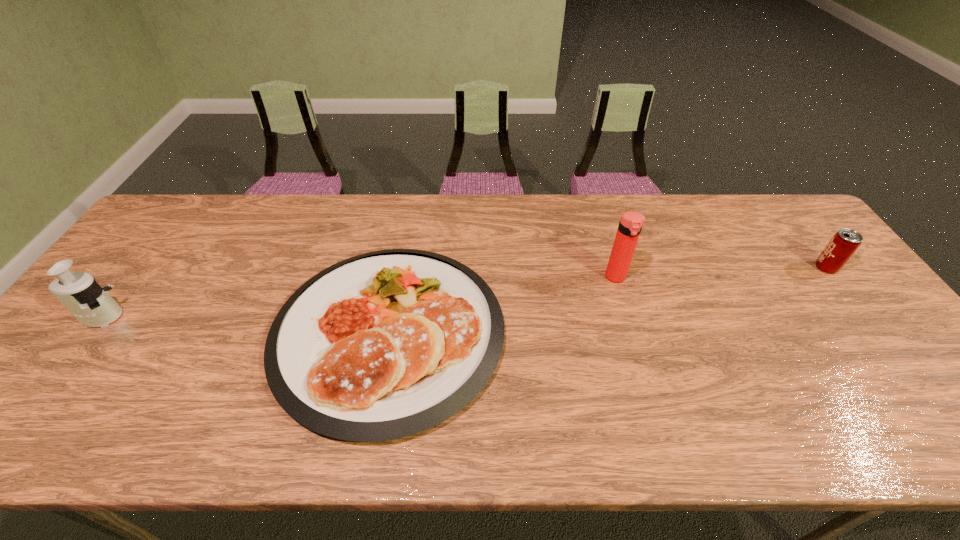
The image size is (960, 540). In order to click on free space located on the back of the rightmost object in this screenshot , I will do `click(781, 211)`.

Image resolution: width=960 pixels, height=540 pixels. What are the coordinates of `vacant space positioned on the back of the second object from left to right` in the screenshot? It's located at (407, 229).

Locate an element on the screen. object present at the near edge is located at coordinates (383, 345).

This screenshot has height=540, width=960. What are the coordinates of `object that is at the left edge` in the screenshot? It's located at (85, 299).

Identify the location of object that is positioned at the right edge. This screenshot has height=540, width=960. (845, 242).

Where is `free point at the far edge`? free point at the far edge is located at coordinates (729, 202).

In order to click on free spot at the near edge of the desktop in this screenshot , I will do `click(544, 437)`.

Locate an element on the screen. This screenshot has width=960, height=540. vacant region at the left edge of the desktop is located at coordinates (69, 374).

This screenshot has width=960, height=540. Find the location of `vacant region at the right edge of the desktop`. vacant region at the right edge of the desktop is located at coordinates (877, 350).

The height and width of the screenshot is (540, 960). In order to click on free space at the far right corner of the desktop in this screenshot , I will do `click(757, 219)`.